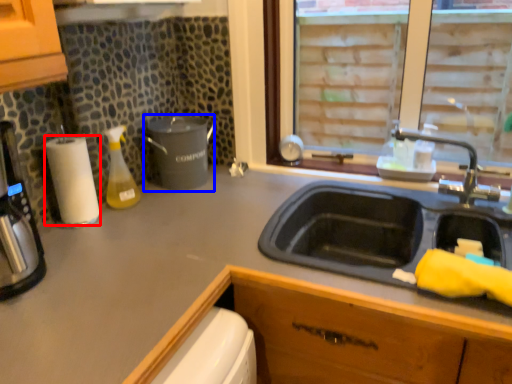
Question: Which object appears farthest to the camera in this image, paper towel (highlighted by a red box) or appliance (highlighted by a blue box)?

Choices:
 (A) paper towel
 (B) appliance

Answer: (B)